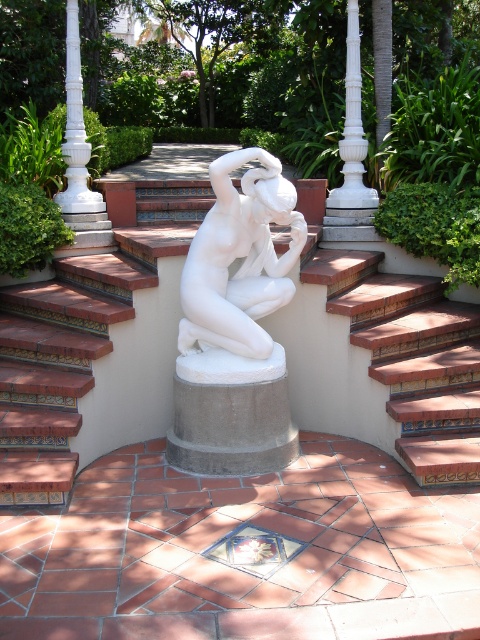
Question: Is white marble statue at center closer to camera compared to white marble pillar at upper center?

Choices:
 (A) no
 (B) yes

Answer: (B)

Question: Observing the image, what is the correct spatial positioning of white marble statue at center in reference to white marble pillar at center?

Choices:
 (A) below
 (B) above

Answer: (A)

Question: Which of the following is the closest to the observer?

Choices:
 (A) (422, 436)
 (B) (357, 237)
 (C) (242, 196)

Answer: (C)

Question: Based on their relative distances, which object is nearer to the white marble pillar at upper center?

Choices:
 (A) terracotta tile stairs at center
 (B) white marble statue at center
 (C) white marble pillar at center

Answer: (A)

Question: Does white marble statue at center have a greater width compared to white marble pillar at center?

Choices:
 (A) yes
 (B) no

Answer: (A)

Question: Which object appears closest to the camera in this image?

Choices:
 (A) terracotta tile stairs at center
 (B) white marble statue at center
 (C) white marble pillar at center

Answer: (B)